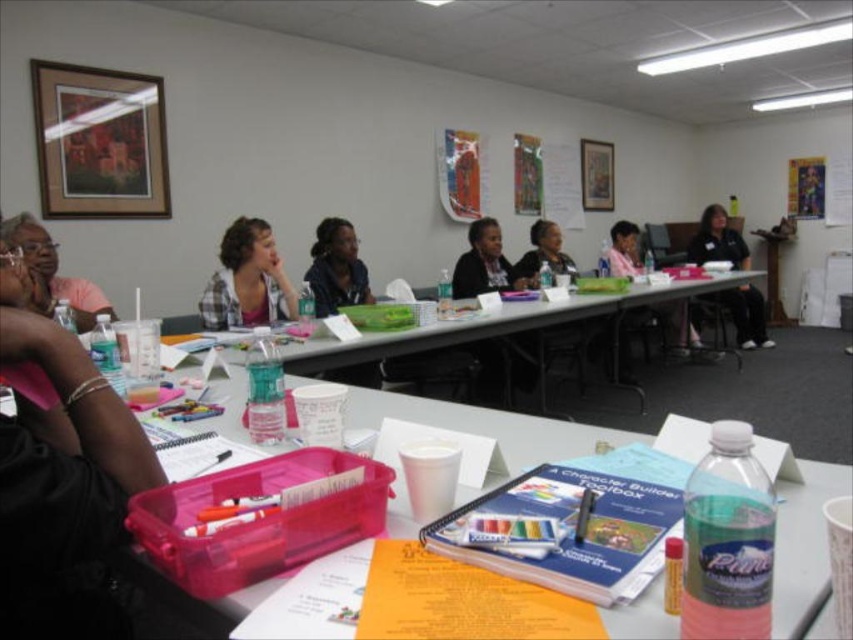
Question: Which point is closer to the camera taking this photo?

Choices:
 (A) (224, 260)
 (B) (732, 257)
 (C) (347, 248)
 (D) (804, 173)

Answer: (A)

Question: Which point appears farthest from the camera in this image?

Choices:
 (A) (x=412, y=410)
 (B) (x=741, y=337)

Answer: (B)

Question: Does black fabric shirt at right have a greater width compared to matte black shirt at center?

Choices:
 (A) yes
 (B) no

Answer: (A)

Question: Is white plastic table at center in front of matte black shirt at center?

Choices:
 (A) yes
 (B) no

Answer: (A)

Question: Can you confirm if white plastic table at center is positioned to the left of black fabric shirt at right?

Choices:
 (A) no
 (B) yes

Answer: (B)

Question: Estimate the real-world distances between objects in this image. Which object is farther from the plaid shirt at center?

Choices:
 (A) matte pink shirt at upper left
 (B) metallic poster at upper right
 (C) translucent plastic table at center
 (D) black fabric shirt at right

Answer: (B)